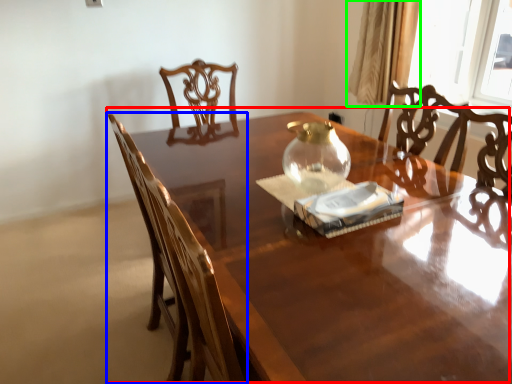
Question: Based on their relative distances, which object is farther from table (highlighted by a red box)? Choose from chair (highlighted by a blue box) and curtain (highlighted by a green box).

Choices:
 (A) chair
 (B) curtain

Answer: (B)